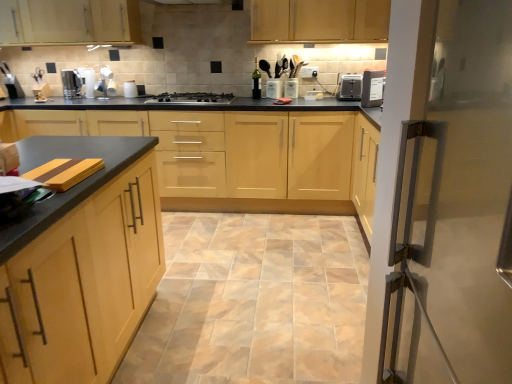
The width and height of the screenshot is (512, 384). What do you see at coordinates (372, 89) in the screenshot?
I see `white plastic toaster at upper right` at bounding box center [372, 89].

You are a GUI agent. You are given a task and a screenshot of the screen. Output one action in this format:
    pyautogui.click(x=<x>, y=<y>)
    Task: Click on the matte wood cabinets at upper center, which is the third cabinetry from bottom to top
    This screenshot has height=384, width=512.
    Given the screenshot: What is the action you would take?
    pyautogui.click(x=319, y=21)

The height and width of the screenshot is (384, 512). What do you see at coordinates (234, 151) in the screenshot?
I see `light wood/veneer cabinets at center, which is counted as the second cabinetry, starting from the bottom` at bounding box center [234, 151].

The height and width of the screenshot is (384, 512). Describe the element at coordinates (69, 21) in the screenshot. I see `light wood cabinet at upper center, which appears as the 4th cabinetry when ordered from the bottom` at that location.

At what (x,y) coordinates should I click in order to perform the action: click on white plastic toaster at upper right. Please return your answer as a coordinate pair (x, y). This screenshot has height=384, width=512. Looking at the image, I should click on (372, 89).

Does satin silver kettle at left have a larger size compared to black plastic toaster at upper right?

Yes, satin silver kettle at left is bigger than black plastic toaster at upper right.

Does satin silver kettle at left have a greater width compared to black plastic toaster at upper right?

In fact, satin silver kettle at left might be narrower than black plastic toaster at upper right.

Could you tell me if satin silver kettle at left is facing black plastic toaster at upper right?

No, satin silver kettle at left is not aimed at black plastic toaster at upper right.

Which point is more distant from viewer, [70,78] or [340,92]?

Point [70,78]

From the image's perspective, between beige ceramic tile at center and matte wood cabinet at left, the first cabinetry when ordered from bottom to top, which one is located above?

matte wood cabinet at left, the first cabinetry when ordered from bottom to top.

What are the coordinates of `ceramic tile on the right of matte wood cabinet at left, the 1th cabinetry viewed from the front` in the screenshot? It's located at (254, 302).

Can you confirm if beige ceramic tile at center is thinner than matte wood cabinet at left, which is the fourth cabinetry from top to bottom?

In fact, beige ceramic tile at center might be wider than matte wood cabinet at left, which is the fourth cabinetry from top to bottom.

Is point (27, 27) in front of point (152, 300)?

No.

From the image's perspective, is light wood cabinet at upper center, the 1th cabinetry in the top-to-bottom sequence, below matte wood cabinet at left, which is the fourth cabinetry from top to bottom?

Incorrect, from the image's perspective, light wood cabinet at upper center, the 1th cabinetry in the top-to-bottom sequence, is higher than matte wood cabinet at left, which is the fourth cabinetry from top to bottom.

Is light wood cabinet at upper center, which is counted as the 1th cabinetry, starting from the back, turned away from matte wood cabinet at left, which ranks as the fourth cabinetry in back-to-front order?

No.

Which is closer to the camera, (366, 91) or (174, 313)?

The point (174, 313) is closer to the camera.

Is white plastic toaster at upper right inside or outside of beige ceramic tile at center?

white plastic toaster at upper right exists outside the volume of beige ceramic tile at center.

How many degrees apart are the facing directions of white plastic toaster at upper right and beige ceramic tile at center?

The angular difference between white plastic toaster at upper right and beige ceramic tile at center is 129 degrees.

Can you confirm if white plastic toaster at upper right is thinner than beige ceramic tile at center?

Indeed, white plastic toaster at upper right has a lesser width compared to beige ceramic tile at center.

From the image's perspective, is white plastic toaster at upper right located above or below matte wood cabinets at upper center, the 2th cabinetry viewed from the top?

white plastic toaster at upper right is below matte wood cabinets at upper center, the 2th cabinetry viewed from the top.

Considering the sizes of objects white plastic toaster at upper right and matte wood cabinets at upper center, the 2th cabinetry viewed from the top, in the image provided, who is smaller, white plastic toaster at upper right or matte wood cabinets at upper center, the 2th cabinetry viewed from the top,?

Smaller between the two is white plastic toaster at upper right.

Is white plastic toaster at upper right turned away from matte wood cabinets at upper center, which is the third cabinetry from bottom to top?

No, white plastic toaster at upper right is not facing the opposite direction of matte wood cabinets at upper center, which is the third cabinetry from bottom to top.

Choose the correct answer: Is white plastic toaster at upper right inside matte wood cabinets at upper center, which is the 3th cabinetry in front-to-back order, or outside it?

The correct answer is: outside.

Could you tell me if black plastic toaster at upper right is turned towards beige ceramic tile at center?

No, black plastic toaster at upper right is not aimed at beige ceramic tile at center.

Does black plastic toaster at upper right have a greater height compared to beige ceramic tile at center?

Yes, black plastic toaster at upper right is taller than beige ceramic tile at center.

Considering the positions of point (356, 79) and point (343, 280), is point (356, 79) closer or farther from the camera than point (343, 280)?

Point (356, 79) appears to be farther away from the viewer than point (343, 280).

From a real-world perspective, which object rests below the other?

In real-world perspective, beige ceramic tile at center is lower.

From the image's perspective, does beige ceramic tile at center appear higher than black plastic toaster at upper right?

Actually, beige ceramic tile at center appears below black plastic toaster at upper right in the image.

Does beige ceramic tile at center come behind black plastic toaster at upper right?

No, it is not.

Considering the sizes of objects beige ceramic tile at center and black plastic toaster at upper right in the image provided, who is shorter, beige ceramic tile at center or black plastic toaster at upper right?

beige ceramic tile at center is shorter.

This screenshot has height=384, width=512. I want to click on kitchen appliance behind the black plastic toaster at upper right, so click(71, 83).

The height and width of the screenshot is (384, 512). I want to click on ceramic tile below the matte wood cabinet at left, which ranks as the fourth cabinetry in back-to-front order (from a real-world perspective), so click(254, 302).

Looking at the image, which one is located closer to matte wood cabinets at upper center, the 2th cabinetry viewed from the top, light wood cabinet at upper center, which is counted as the 1th cabinetry, starting from the back, or light wood/veneer cabinets at center, the 3th cabinetry viewed from the back?

The object closer to matte wood cabinets at upper center, the 2th cabinetry viewed from the top, is light wood/veneer cabinets at center, the 3th cabinetry viewed from the back.

Based on their spatial positions, is white plastic toaster at upper right or beige ceramic tile at center further from satin silver kettle at left?

Based on the image, white plastic toaster at upper right appears to be further to satin silver kettle at left.

From the image, which object appears to be nearer to light wood cabinet at upper center, the 4th cabinetry from the front, satin silver kettle at left or matte wood cabinets at upper center, the second cabinetry positioned from the back?

Among the two, satin silver kettle at left is located nearer to light wood cabinet at upper center, the 4th cabinetry from the front.

From the image, which object appears to be nearer to black plastic toaster at upper right, white plastic toaster at upper right or matte wood cabinets at upper center, the second cabinetry positioned from the back?

white plastic toaster at upper right is positioned closer to the anchor black plastic toaster at upper right.

From the image, which object appears to be nearer to black plastic toaster at upper right, matte wood cabinets at upper center, the 2th cabinetry viewed from the top, or light wood/veneer cabinets at center, arranged as the 3th cabinetry when viewed from the top?

matte wood cabinets at upper center, the 2th cabinetry viewed from the top.

Considering their positions, is matte wood cabinet at left, which is the fourth cabinetry from top to bottom, positioned further to light wood cabinet at upper center, which is counted as the 1th cabinetry, starting from the back, than matte wood cabinets at upper center, which is the 3th cabinetry in front-to-back order?

matte wood cabinet at left, which is the fourth cabinetry from top to bottom, lies further to light wood cabinet at upper center, which is counted as the 1th cabinetry, starting from the back, than the other object.

In the scene shown: Considering their positions, is stainless steel gas stove at center positioned closer to beige ceramic tile at center than light wood cabinet at upper center, which appears as the 4th cabinetry when ordered from the bottom?

stainless steel gas stove at center is closer to beige ceramic tile at center.

Looking at the image, which one is located closer to light wood cabinet at upper center, the 4th cabinetry from the front, matte wood cabinets at upper center, which is the 3th cabinetry in front-to-back order, or black plastic toaster at upper right?

matte wood cabinets at upper center, which is the 3th cabinetry in front-to-back order, is positioned closer to the anchor light wood cabinet at upper center, the 4th cabinetry from the front.

The height and width of the screenshot is (384, 512). What are the coordinates of `gas stove between matte wood cabinet at left, the first cabinetry when ordered from bottom to top, and black plastic toaster at upper right in the front-back direction` in the screenshot? It's located at (191, 98).

You are a GUI agent. You are given a task and a screenshot of the screen. Output one action in this format:
    pyautogui.click(x=<x>, y=<y>)
    Task: Click on the ceramic tile between matte wood cabinet at left, which is the fourth cabinetry from top to bottom, and light wood cabinet at upper center, the 1th cabinetry in the top-to-bottom sequence, in the front-back direction
    
    Given the screenshot: What is the action you would take?
    pyautogui.click(x=254, y=302)

Where is `appliance situated between light wood cabinet at upper center, which is counted as the 1th cabinetry, starting from the back, and white plastic toaster at upper right from left to right`? Image resolution: width=512 pixels, height=384 pixels. appliance situated between light wood cabinet at upper center, which is counted as the 1th cabinetry, starting from the back, and white plastic toaster at upper right from left to right is located at coordinates (349, 87).

Where is `gas stove between beige ceramic tile at center and satin silver kettle at left along the z-axis`? The height and width of the screenshot is (384, 512). gas stove between beige ceramic tile at center and satin silver kettle at left along the z-axis is located at coordinates point(191,98).